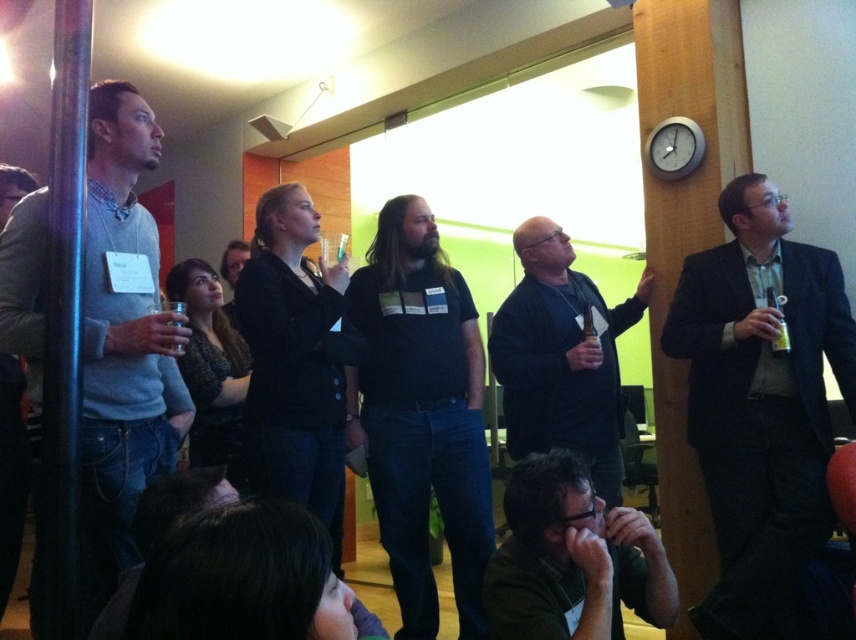
Between matte gray sweater at left and green matte shirt at lower center, which one has more height?

With more height is matte gray sweater at left.

Who is higher up, matte gray sweater at left or green matte shirt at lower center?

matte gray sweater at left is above.

Between point (86, 170) and point (548, 492), which one is positioned behind?

Point (548, 492)

Find the location of a particular element. matte gray sweater at left is located at coordinates (122, 342).

Measure the distance from dark suit at right to green matte shirt at lower center.

dark suit at right is 33.27 inches from green matte shirt at lower center.

Who is positioned more to the right, dark suit at right or green matte shirt at lower center?

dark suit at right is more to the right.

Is point (786, 632) closer to viewer compared to point (528, 513)?

No, it is not.

Find the location of a particular element. Image resolution: width=856 pixels, height=640 pixels. dark suit at right is located at coordinates (761, 406).

Which is behind, point (494, 349) or point (608, 625)?

The point (494, 349) is behind.

The height and width of the screenshot is (640, 856). In order to click on dark gray sweater at center in this screenshot , I will do (x=562, y=356).

The height and width of the screenshot is (640, 856). What are the coordinates of `dark gray sweater at center` in the screenshot? It's located at (562, 356).